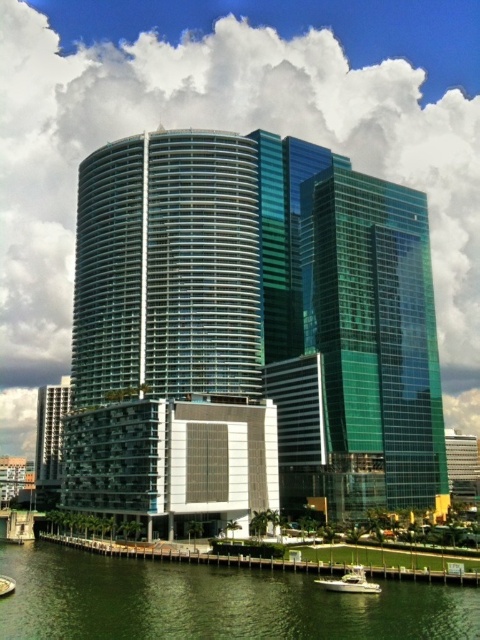
You are standing at the dock and looking towards the high rise buildings. There are two points marked in the scene, point (x=374, y=362) and point (x=83, y=538). Which point is closer to you?

Point (x=374, y=362) is further to the camera than point (x=83, y=538), so the point closer to you is point (x=83, y=538).

You are standing at the dock and want to take a photo of the two points marked in the scene. Which point, point (x=95, y=627) or point (x=348, y=584), will appear larger in your camera view?

Point (x=95, y=627) will appear larger in your camera view because it is closer to the camera than point (x=348, y=584).

You are a photographer standing on the dock and want to capture the white glossy boat at lower center and the green water at lower center in your shot. Which object occupies more horizontal space in the frame?

The green water at lower center occupies more horizontal space in the frame because its width surpasses that of the white glossy boat at lower center.